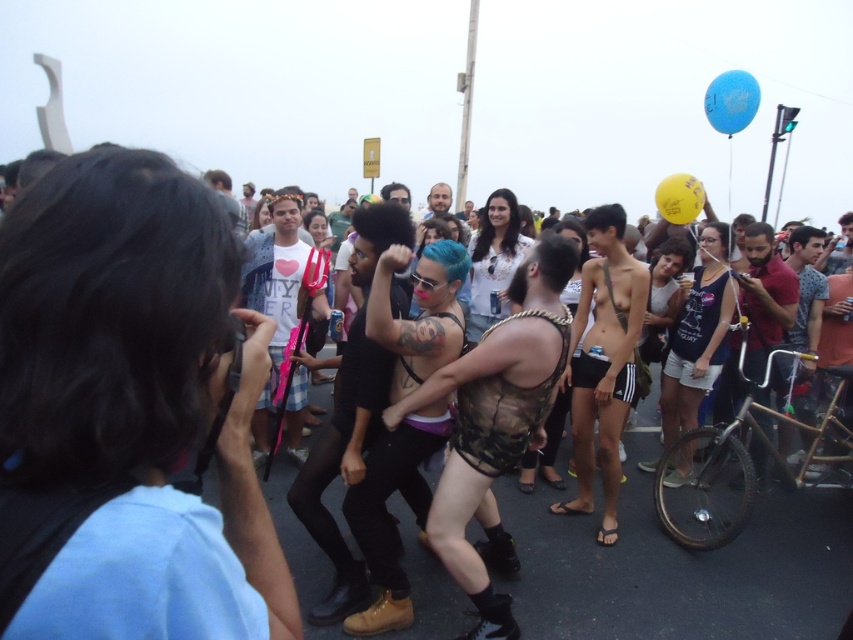
Describe the element at coordinates (496, 422) in the screenshot. I see `camouflage fabric vest at center` at that location.

Does camouflage fabric vest at center have a lesser height compared to camouflage-patterned shirt at right?

Indeed, camouflage fabric vest at center has a lesser height compared to camouflage-patterned shirt at right.

Which is in front, point (474, 392) or point (798, 234)?

Positioned in front is point (474, 392).

Where is `camouflage fabric vest at center`? This screenshot has width=853, height=640. camouflage fabric vest at center is located at coordinates (496, 422).

Is dark hair at center shorter than camouflage fabric vest at center?

Yes, dark hair at center is shorter than camouflage fabric vest at center.

Consider the image. Does dark hair at center appear on the left side of camouflage fabric vest at center?

Indeed, dark hair at center is positioned on the left side of camouflage fabric vest at center.

Which is in front, point (138, 200) or point (490, 531)?

Point (138, 200)

At what (x,y) coordinates should I click in order to perform the action: click on dark hair at center. Please return your answer as a coordinate pair (x, y). Looking at the image, I should click on (126, 413).

Does denim shorts at center lie in front of light brown hair at center?

Yes.

Does denim shorts at center have a smaller size compared to light brown hair at center?

Yes, denim shorts at center is smaller than light brown hair at center.

Is point (698, 385) positioned after point (445, 192)?

No, it is in front of (445, 192).

Where is `denim shorts at center`? denim shorts at center is located at coordinates (698, 336).